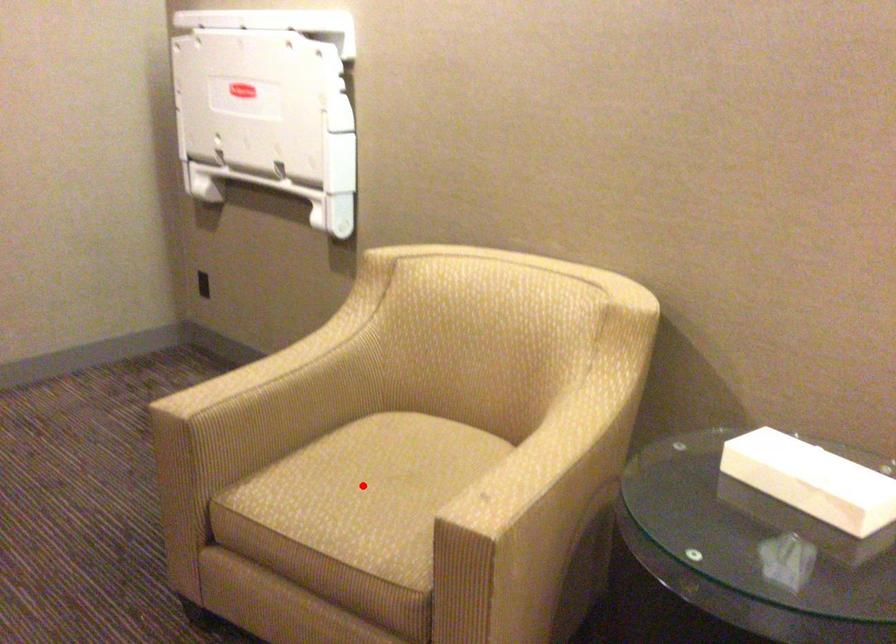
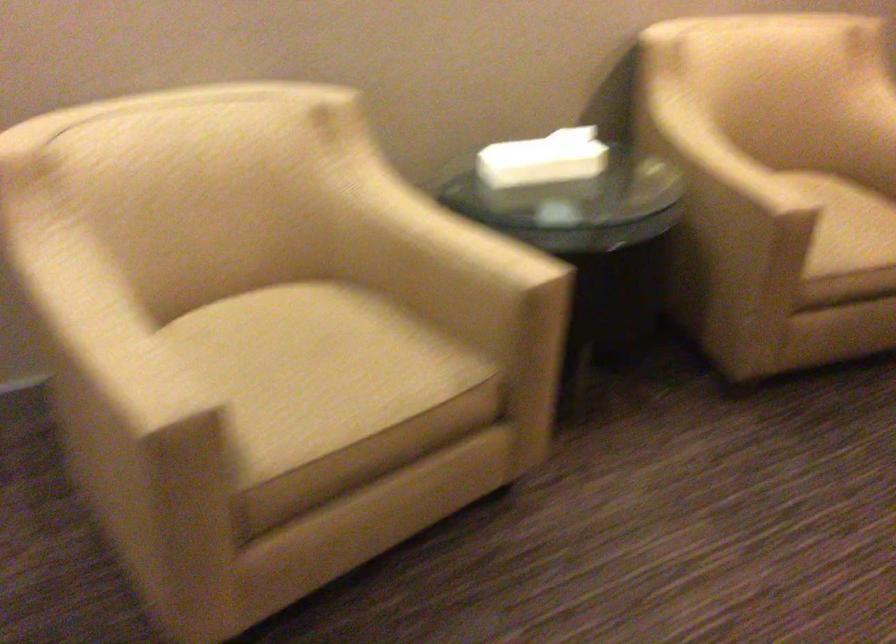
Question: A red point is marked in image1. In image2, is the corresponding 3D point closer to the camera or farther? Reply with the corresponding letter.

Choices:
 (A) The corresponding 3D point is closer.
 (B) The corresponding 3D point is farther.

Answer: (A)